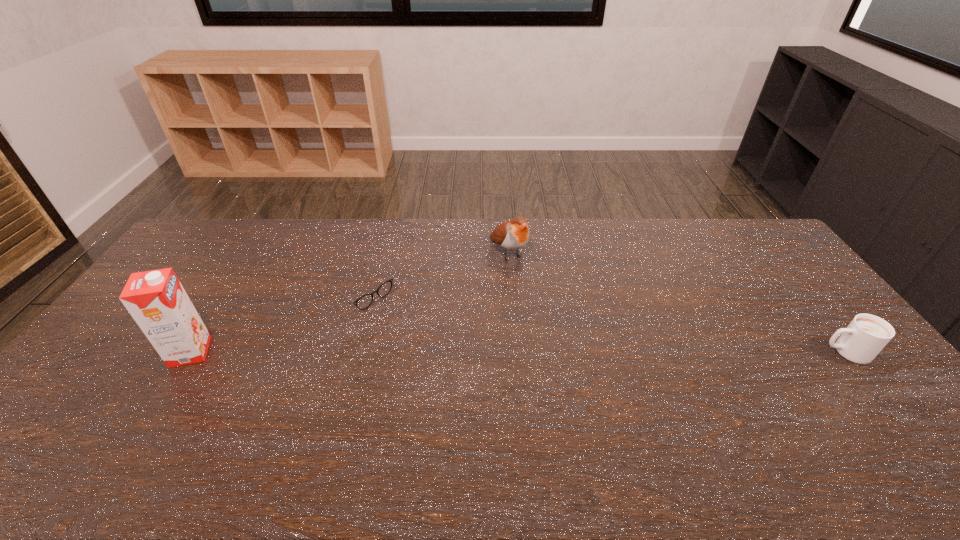
At what (x,y) coordinates should I click in order to perform the action: click on free spot on the desktop that is between the carton and the second shortest object and is positioned through the lenses of the second object from left to right. Please return your answer as a coordinate pair (x, y). Looking at the image, I should click on [443, 352].

At what (x,y) coordinates should I click in order to perform the action: click on free space on the desktop that is between the carton and the cappuccino and is positioned at the face of the third shortest object. Please return your answer as a coordinate pair (x, y). Looking at the image, I should click on (594, 352).